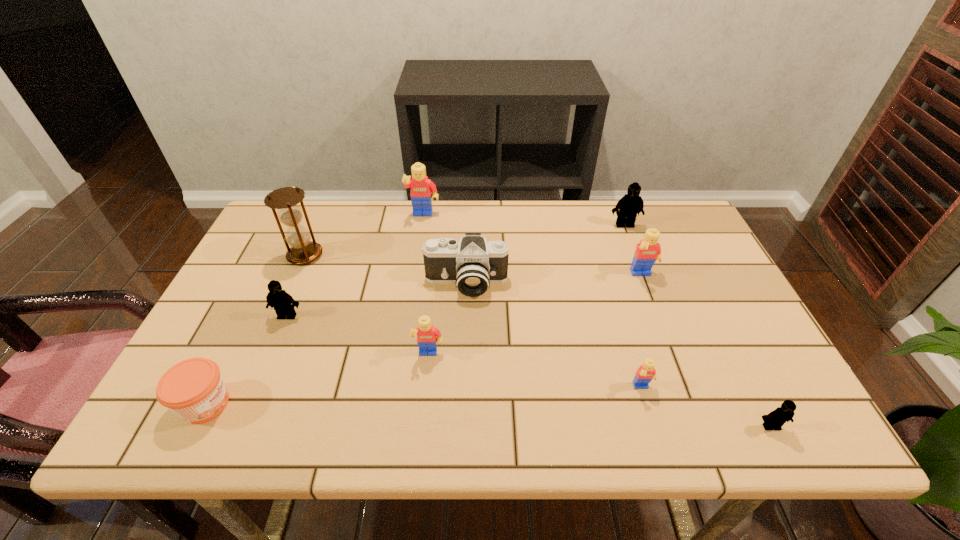
Select which Lego is the closest to the fifth farthest Lego. Please provide its 2D coordinates. Your answer should be formatted as a tuple, i.e. [(x, y)], where the tuple contains the x and y coordinates of a point satisfying the conditions above.

[(283, 303)]

Locate an element on the screen. the fourth closest Lego to the rightmost yellow Lego is located at coordinates (428, 336).

Select which yellow Lego appears as the third closest to the third nearest yellow Lego. Please provide its 2D coordinates. Your answer should be formatted as a tuple, i.e. [(x, y)], where the tuple contains the x and y coordinates of a point satisfying the conditions above.

[(421, 187)]

I want to click on the fourth closest yellow Lego to the jam, so click(x=648, y=251).

Locate an element on the screen. black Lego that is the closest to the fourth nearest Lego is located at coordinates (630, 204).

This screenshot has height=540, width=960. I want to click on the closest black Lego to the second black Lego from left to right, so click(776, 419).